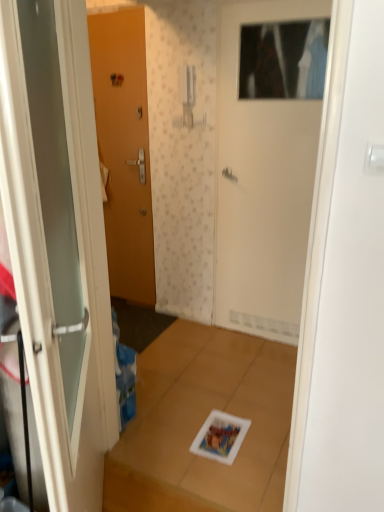
The height and width of the screenshot is (512, 384). I want to click on white glossy door at left, the second door viewed from the right, so click(58, 241).

Based on their positions, is matte wood door at left, which ranks as the first door in left-to-right order, located to the left or right of white matte door at upper center, the 1th door positioned from the right?

From the image, it's evident that matte wood door at left, which ranks as the first door in left-to-right order, is to the left of white matte door at upper center, the 1th door positioned from the right.

Is matte wood door at left, positioned as the first door in back-to-front order, bigger than white matte door at upper center, the 2th door positioned from the front?

Incorrect, matte wood door at left, positioned as the first door in back-to-front order, is not larger than white matte door at upper center, the 2th door positioned from the front.

Is point (122, 32) positioned in front of point (235, 62)?

That is False.

Does white matte door at upper center, the 2th door positioned from the front, turn towards white glossy door at left, which is the first door from front to back?

Yes, white matte door at upper center, the 2th door positioned from the front, is facing white glossy door at left, which is the first door from front to back.

In the scene shown: Can you confirm if white matte door at upper center, the 3th door positioned from the left, is smaller than white glossy door at left, which is the first door from front to back?

Yes, white matte door at upper center, the 3th door positioned from the left, is smaller than white glossy door at left, which is the first door from front to back.

From the image's perspective, between white matte door at upper center, the 1th door positioned from the right, and white glossy door at left, which is the first door from front to back, who is located below?

white glossy door at left, which is the first door from front to back, appears lower in the image.

Considering the relative positions of white matte door at upper center, the 3th door positioned from the left, and white glossy door at left, the second door viewed from the right, in the image provided, is white matte door at upper center, the 3th door positioned from the left, to the left or to the right of white glossy door at left, the second door viewed from the right,?

white matte door at upper center, the 3th door positioned from the left, is positioned on white glossy door at left, the second door viewed from the right,'s right side.

Which of these two, white glossy door at left, which is the first door from front to back, or white matte door at upper center, which is the 2th door in back-to-front order, stands taller?

white matte door at upper center, which is the 2th door in back-to-front order.

There is a white glossy door at left, the 3th door positioned from the back. Where is `the 1st door above it (from the image's perspective)`? The height and width of the screenshot is (512, 384). the 1st door above it (from the image's perspective) is located at coordinates (264, 178).

From the image's perspective, is white glossy door at left, the second door viewed from the right, above white matte door at upper center, the 2th door positioned from the front?

No, from the image's perspective, white glossy door at left, the second door viewed from the right, is not on top of white matte door at upper center, the 2th door positioned from the front.

Consider the image. What's the angular difference between white glossy door at left, which is the first door from front to back, and white matte door at upper center, the 2th door positioned from the front,'s facing directions?

white glossy door at left, which is the first door from front to back, and white matte door at upper center, the 2th door positioned from the front, are facing 124 degrees away from each other.

Where is `door on the left of white glossy door at left, which is the first door from front to back`? Image resolution: width=384 pixels, height=512 pixels. door on the left of white glossy door at left, which is the first door from front to back is located at coordinates (124, 149).

Looking at the image, does matte wood door at left, which is the third door from front to back, seem bigger or smaller compared to white glossy door at left, acting as the second door starting from the left?

Clearly, matte wood door at left, which is the third door from front to back, is smaller in size than white glossy door at left, acting as the second door starting from the left.

Is matte wood door at left, which ranks as the first door in left-to-right order, inside the boundaries of white glossy door at left, the 3th door positioned from the back, or outside?

matte wood door at left, which ranks as the first door in left-to-right order, is not inside white glossy door at left, the 3th door positioned from the back, it's outside.

Between matte wood door at left, which ranks as the first door in left-to-right order, and white glossy door at left, the second door viewed from the right, which one appears on the right side from the viewer's perspective?

From the viewer's perspective, white glossy door at left, the second door viewed from the right, appears more on the right side.

Considering the relative sizes of white glossy door at left, the second door viewed from the right, and matte wood door at left, which ranks as the first door in left-to-right order, in the image provided, is white glossy door at left, the second door viewed from the right, shorter than matte wood door at left, which ranks as the first door in left-to-right order,?

Yes, white glossy door at left, the second door viewed from the right, is shorter than matte wood door at left, which ranks as the first door in left-to-right order.

Is white glossy door at left, which is the first door from front to back, not within matte wood door at left, which is the third door from front to back?

Yes.

Is white glossy door at left, the second door viewed from the right, next to matte wood door at left, positioned as the first door in back-to-front order, and touching it?

No, white glossy door at left, the second door viewed from the right, is not next to matte wood door at left, positioned as the first door in back-to-front order.

From the image's perspective, relative to matte wood door at left, positioned as the first door in back-to-front order, is white glossy door at left, acting as the second door starting from the left, above or below?

Based on their image positions, white glossy door at left, acting as the second door starting from the left, is located beneath matte wood door at left, positioned as the first door in back-to-front order.

Is white matte door at upper center, the 2th door positioned from the front, far away from matte wood door at left, the third door when ordered from right to left?

white matte door at upper center, the 2th door positioned from the front, is near matte wood door at left, the third door when ordered from right to left, not far away.

From the image's perspective, is white matte door at upper center, the 3th door positioned from the left, beneath matte wood door at left, positioned as the first door in back-to-front order?

Indeed, from the image's perspective, white matte door at upper center, the 3th door positioned from the left, is shown beneath matte wood door at left, positioned as the first door in back-to-front order.

How much distance is there between white matte door at upper center, the 2th door positioned from the front, and matte wood door at left, the third door when ordered from right to left?

white matte door at upper center, the 2th door positioned from the front, and matte wood door at left, the third door when ordered from right to left, are 31.18 inches apart from each other.

Is white matte door at upper center, the 3th door positioned from the left, behind matte wood door at left, positioned as the first door in back-to-front order?

That is False.

You are a GUI agent. You are given a task and a screenshot of the screen. Output one action in this format:
    pyautogui.click(x=<x>, y=<y>)
    Task: Click on the 2nd door to the left of the white matte door at upper center, the 1th door positioned from the right, starting your count from the anchor
    This screenshot has width=384, height=512.
    Given the screenshot: What is the action you would take?
    pyautogui.click(x=124, y=149)

Where is `door in front of the white matte door at upper center, the 2th door positioned from the front`? This screenshot has height=512, width=384. door in front of the white matte door at upper center, the 2th door positioned from the front is located at coordinates (58, 241).

From the image, which object appears to be farther from white glossy door at left, acting as the second door starting from the left, white matte door at upper center, which is the 2th door in back-to-front order, or matte wood door at left, which ranks as the first door in left-to-right order?

matte wood door at left, which ranks as the first door in left-to-right order, is further to white glossy door at left, acting as the second door starting from the left.

Estimate the real-world distances between objects in this image. Which object is further from white glossy door at left, the second door viewed from the right, matte wood door at left, the third door when ordered from right to left, or white matte door at upper center, the 2th door positioned from the front?

matte wood door at left, the third door when ordered from right to left, is positioned further to the anchor white glossy door at left, the second door viewed from the right.

Looking at the image, which one is located further to matte wood door at left, the third door when ordered from right to left, white matte door at upper center, the 2th door positioned from the front, or white glossy door at left, the 3th door positioned from the back?

white glossy door at left, the 3th door positioned from the back, is positioned further to the anchor matte wood door at left, the third door when ordered from right to left.

Based on their spatial positions, is white glossy door at left, the second door viewed from the right, or white matte door at upper center, the 2th door positioned from the front, further from matte wood door at left, positioned as the first door in back-to-front order?

The object further to matte wood door at left, positioned as the first door in back-to-front order, is white glossy door at left, the second door viewed from the right.

When comparing their distances from white matte door at upper center, the 3th door positioned from the left, does white glossy door at left, which is the first door from front to back, or matte wood door at left, positioned as the first door in back-to-front order, seem further?

white glossy door at left, which is the first door from front to back, lies further to white matte door at upper center, the 3th door positioned from the left, than the other object.

Which object lies nearer to the anchor point white matte door at upper center, the 3th door positioned from the left, matte wood door at left, the third door when ordered from right to left, or white glossy door at left, the 3th door positioned from the back?

matte wood door at left, the third door when ordered from right to left.

In order to click on door positioned between white glossy door at left, the 3th door positioned from the back, and matte wood door at left, the third door when ordered from right to left, from near to far in this screenshot , I will do `click(264, 178)`.